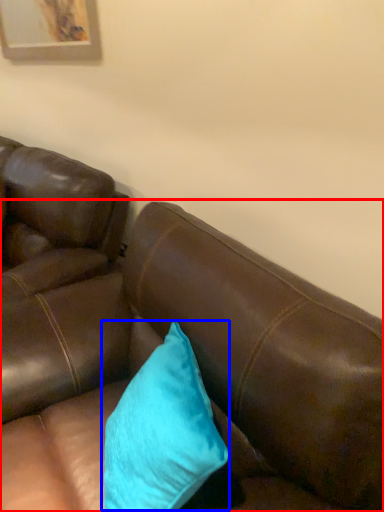
Question: Which object is further to the camera taking this photo, studio couch (highlighted by a red box) or pillow (highlighted by a blue box)?

Choices:
 (A) studio couch
 (B) pillow

Answer: (B)